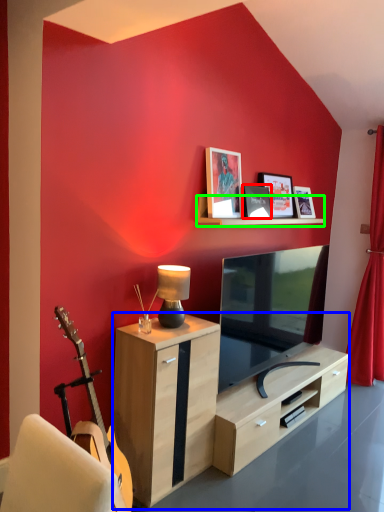
Question: Which object is the closest to the picture frame (highlighted by a red box)? Choose among these: desk (highlighted by a blue box) or shelf (highlighted by a green box).

Choices:
 (A) desk
 (B) shelf

Answer: (B)